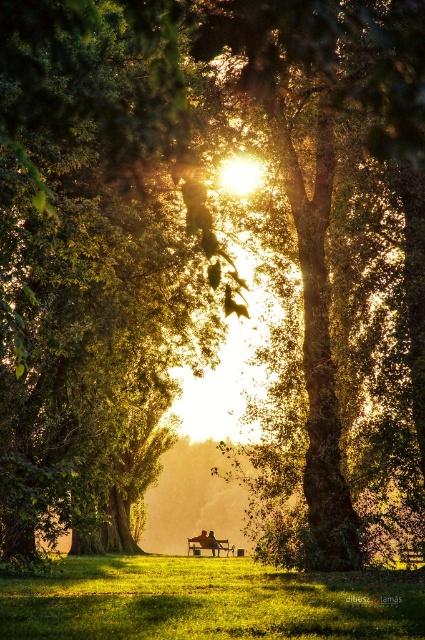
You are a photographer trying to capture a photo of the wooden bench at center and the red fabric person at center. Since the sun is low in the sky, you want to avoid harsh shadows. Which object should you position closer to the light source to ensure both are well lit without casting shadows over each other?

The wooden bench at center is located above the red fabric person at center. To avoid shadows, position the wooden bench at center closer to the light source since it is higher and might cast a shadow on the lower red fabric person at center if not properly aligned.

You are a park visitor who wants to sit on the wooden bench at center. There is a red fabric person at center already occupying part of it. Can you sit on the remaining space without being too close to the person?

The wooden bench at center is 2.95 inches away from the red fabric person at center. Since the distance between them is quite close, sitting there might be too near to the person. Consider finding another bench.